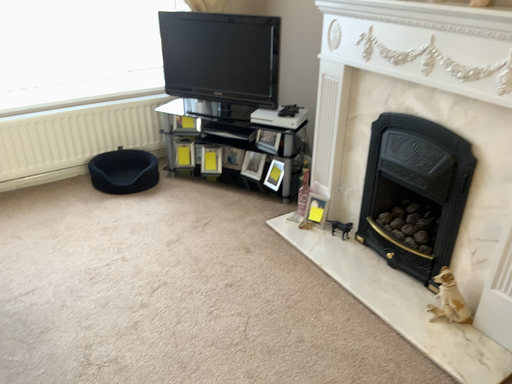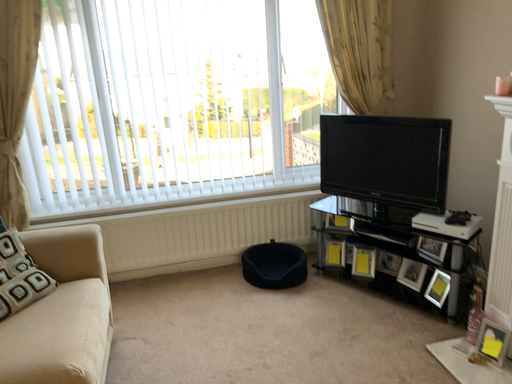
Question: How did the camera likely rotate when shooting the video?

Choices:
 (A) rotated right
 (B) rotated left

Answer: (B)